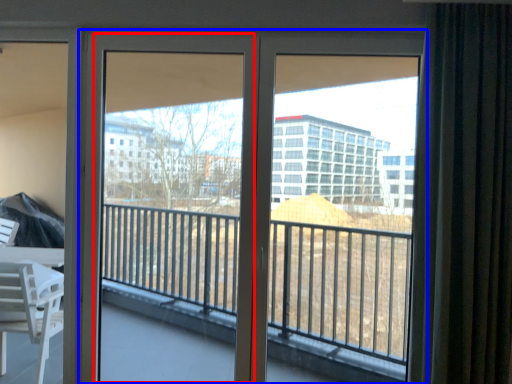
Question: Which object appears closest to the camera in this image, screen door (highlighted by a red box) or door (highlighted by a blue box)?

Choices:
 (A) screen door
 (B) door

Answer: (B)